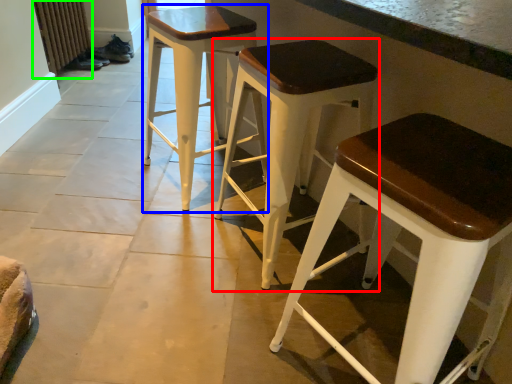
Question: Estimate the real-world distances between objects in this image. Which object is farther from stool (highlighted by a red box), stool (highlighted by a blue box) or radiator (highlighted by a green box)?

Choices:
 (A) stool
 (B) radiator

Answer: (B)